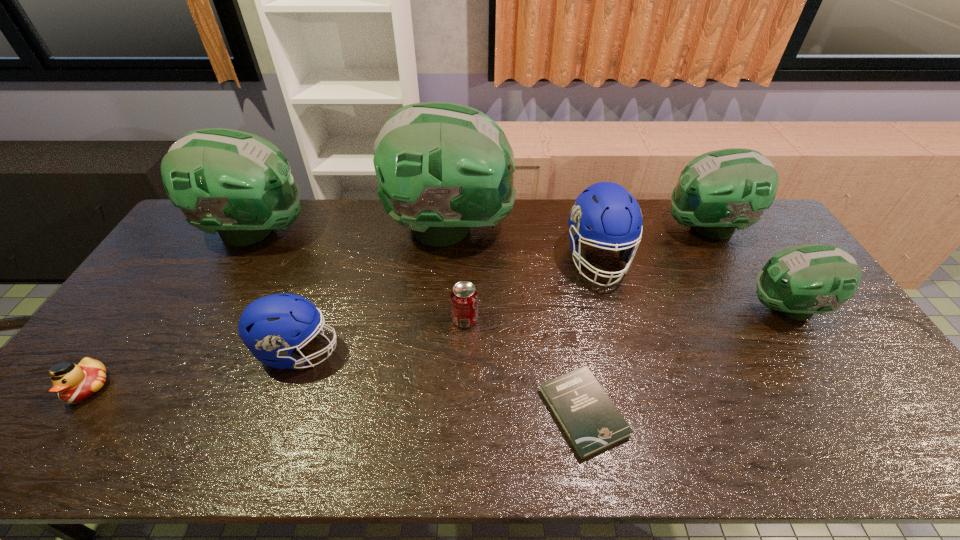
The image size is (960, 540). I want to click on the biggest green football helmet, so click(x=443, y=168).

This screenshot has width=960, height=540. I want to click on the third football helmet from left to right, so click(x=443, y=168).

Where is `the eighth shortest object`? The image size is (960, 540). the eighth shortest object is located at coordinates (238, 184).

The image size is (960, 540). I want to click on the leftmost green football helmet, so click(238, 184).

I want to click on the second smallest green football helmet, so click(x=719, y=191).

Locate an element on the screen. Image resolution: width=960 pixels, height=540 pixels. the third football helmet from right to left is located at coordinates (614, 215).

At what (x,y) coordinates should I click in order to perform the action: click on the bigger blue football helmet. Please return your answer as a coordinate pair (x, y). This screenshot has height=540, width=960. Looking at the image, I should click on (614, 215).

The height and width of the screenshot is (540, 960). In order to click on the nearest green football helmet in this screenshot , I will do `click(799, 281)`.

Identify the location of the smaller blue football helmet. The height and width of the screenshot is (540, 960). (269, 326).

Identify the location of the left blue football helmet. This screenshot has height=540, width=960. (269, 326).